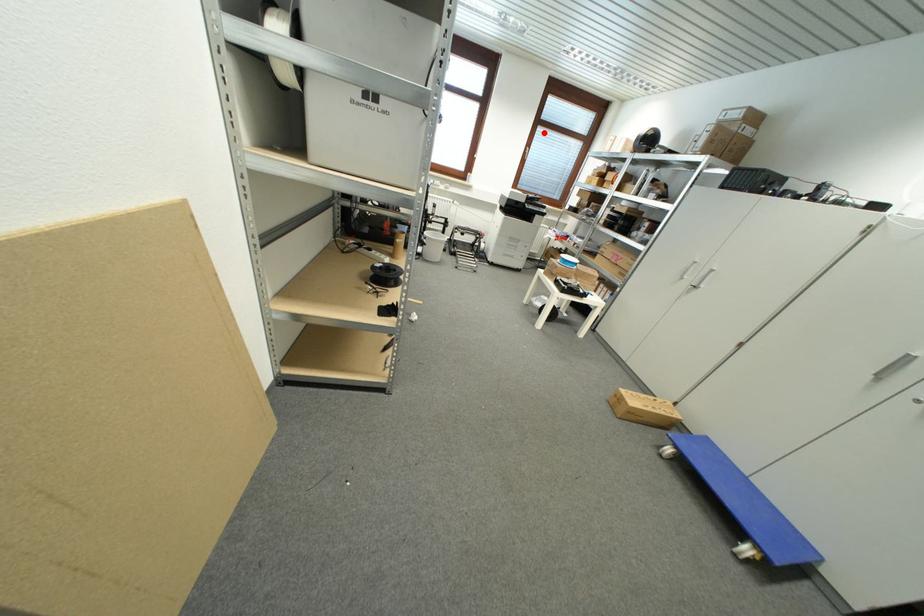
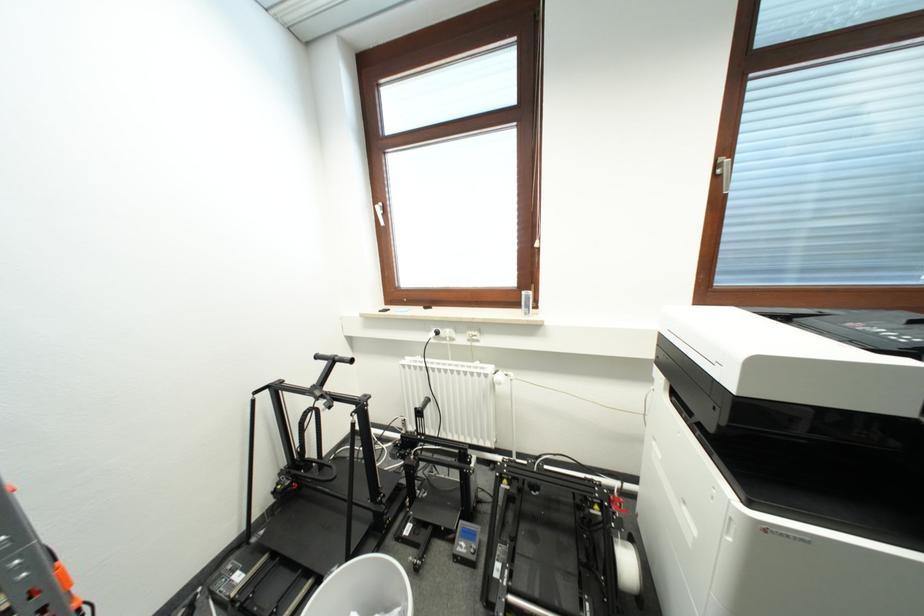
Where in the second image is the point corresponding to the highlighted location from the first image?

(766, 89)